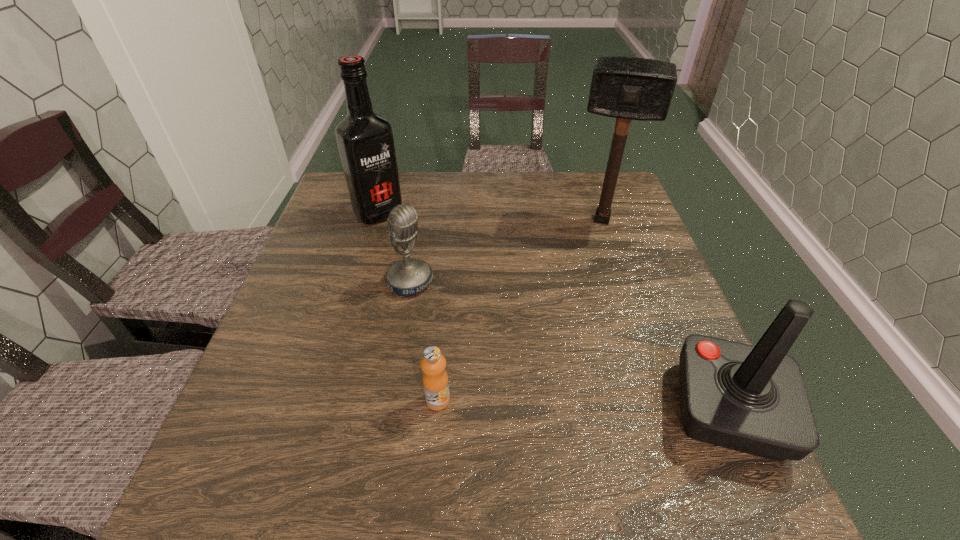
This screenshot has height=540, width=960. What are the coordinates of `free space located 0.280m on the front-facing side of the microphone` in the screenshot? It's located at (521, 360).

The image size is (960, 540). I want to click on vacant space positioned on the front-facing side of the microphone, so click(x=495, y=341).

Where is `vacant region located on the head of the mallet`? The height and width of the screenshot is (540, 960). vacant region located on the head of the mallet is located at coordinates (581, 334).

Identify the location of vacant area located 0.310m on the head of the mallet. This screenshot has width=960, height=540. (584, 318).

This screenshot has height=540, width=960. What are the coordinates of `vacant position located 0.350m on the head of the mallet` in the screenshot? It's located at (582, 331).

Identify the location of free space located 0.360m on the front-facing side of the liquor. (469, 298).

At what (x,y) coordinates should I click in order to perform the action: click on vacant space located 0.050m on the front-facing side of the liquor. Please return your answer as a coordinate pair (x, y). This screenshot has height=540, width=960. Looking at the image, I should click on (400, 233).

Locate an element on the screen. The image size is (960, 540). free space located on the front-facing side of the liquor is located at coordinates (451, 281).

The image size is (960, 540). In order to click on mallet at the far edge in this screenshot , I will do `click(626, 88)`.

The width and height of the screenshot is (960, 540). I want to click on liquor that is at the far edge, so click(365, 140).